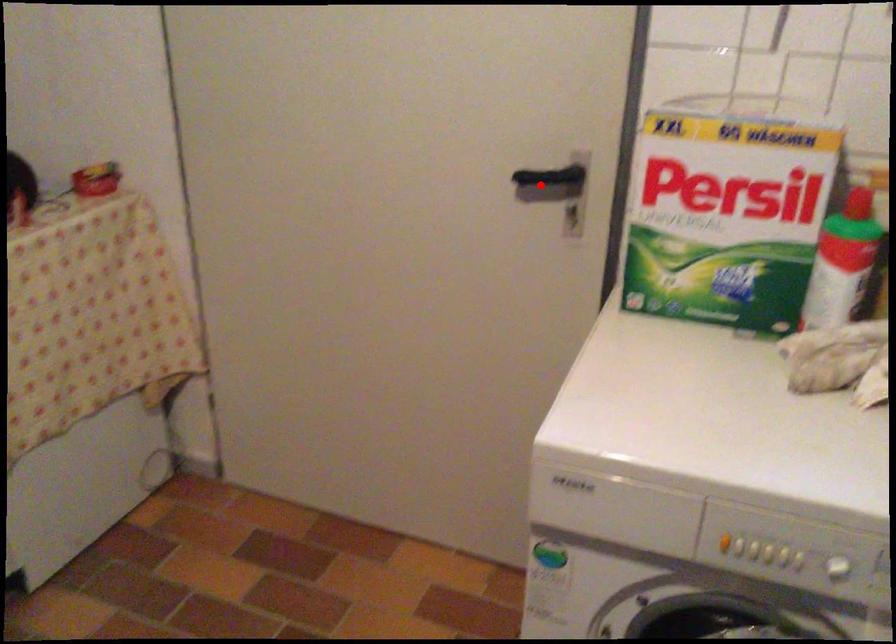
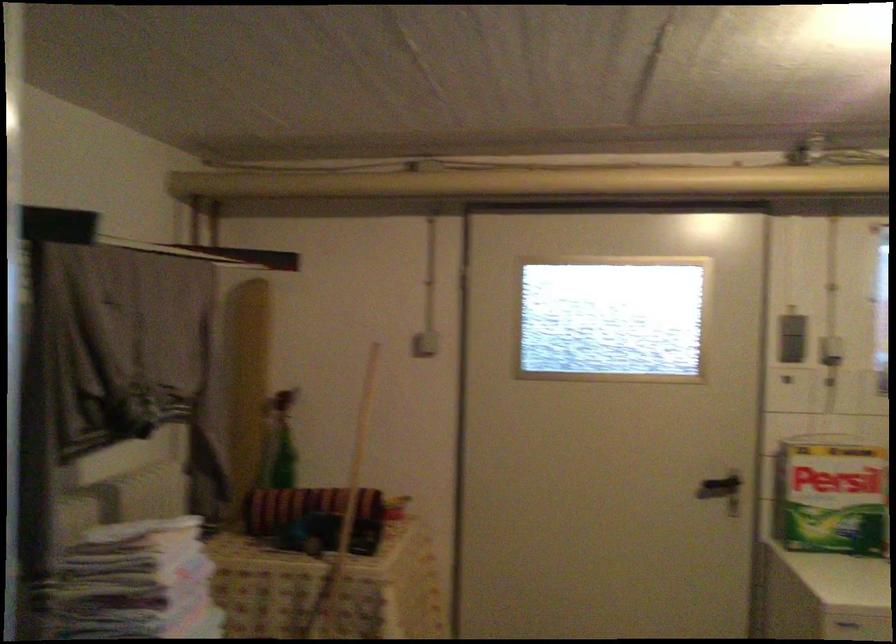
Question: I am providing you with two images of the same scene from different viewpoints. Given a red point in image1, look at the same physical point in image2. Is it:

Choices:
 (A) Closer to the viewpoint
 (B) Farther from the viewpoint

Answer: (B)